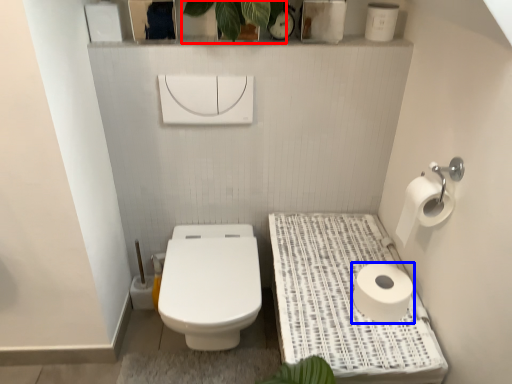
Question: Which of the following is the closest to the observer, plant (highlighted by a red box) or toilet paper (highlighted by a blue box)?

Choices:
 (A) plant
 (B) toilet paper

Answer: (A)